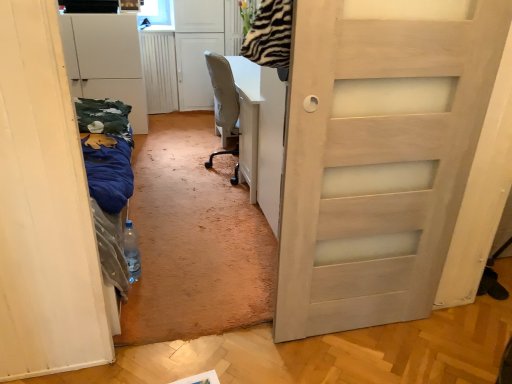
Locate an element on the screen. The height and width of the screenshot is (384, 512). vacant space to the right of translucent plastic bottle at center is located at coordinates (168, 281).